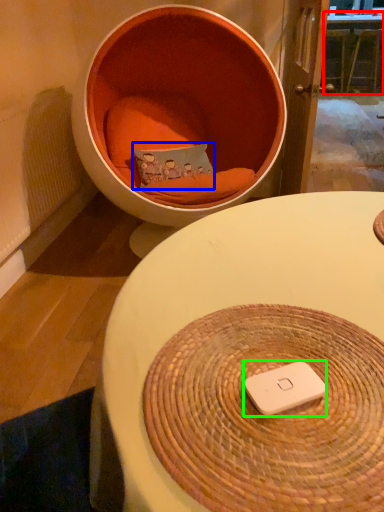
Question: Based on their relative distances, which object is nearer to table (highlighted by a red box)? Choose from pillow (highlighted by a blue box) and ipod (highlighted by a green box).

Choices:
 (A) pillow
 (B) ipod

Answer: (A)